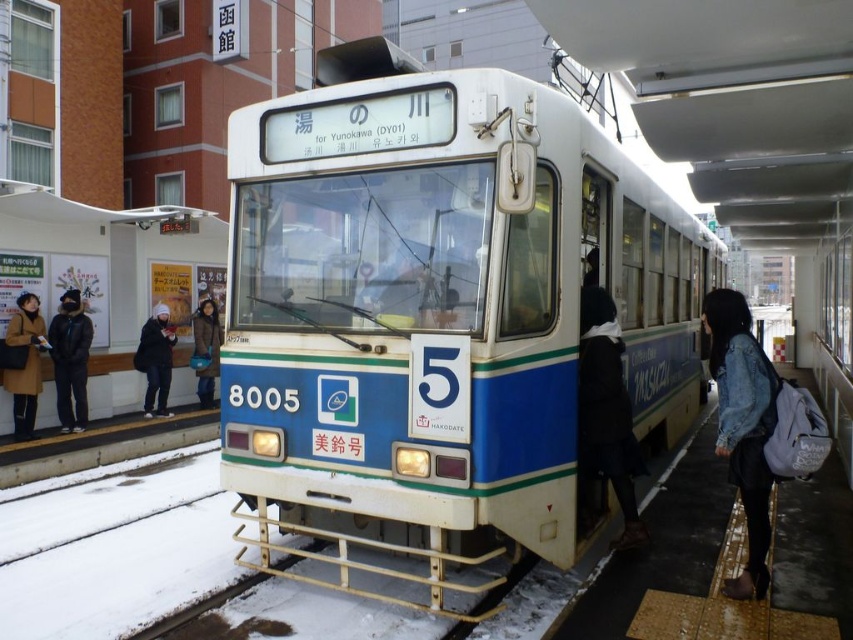
Question: Which point is farther from the camera taking this photo?

Choices:
 (A) (738, 420)
 (B) (20, 410)
 (C) (622, 268)

Answer: (B)

Question: Estimate the real-world distances between objects in this image. Which object is farther from the denim jacket at lower right?

Choices:
 (A) brown leather coat at left
 (B) blue matte train at center

Answer: (A)

Question: Considering the relative positions of blue matte train at center and denim jacket at lower right in the image provided, where is blue matte train at center located with respect to denim jacket at lower right?

Choices:
 (A) right
 (B) left

Answer: (B)

Question: Can you confirm if blue matte train at center is wider than denim jacket at lower right?

Choices:
 (A) yes
 (B) no

Answer: (A)

Question: Where is blue matte train at center located in relation to brown leather coat at left in the image?

Choices:
 (A) right
 (B) left

Answer: (A)

Question: Which point is closer to the camera taking this photo?

Choices:
 (A) (538, 240)
 (B) (32, 420)

Answer: (A)